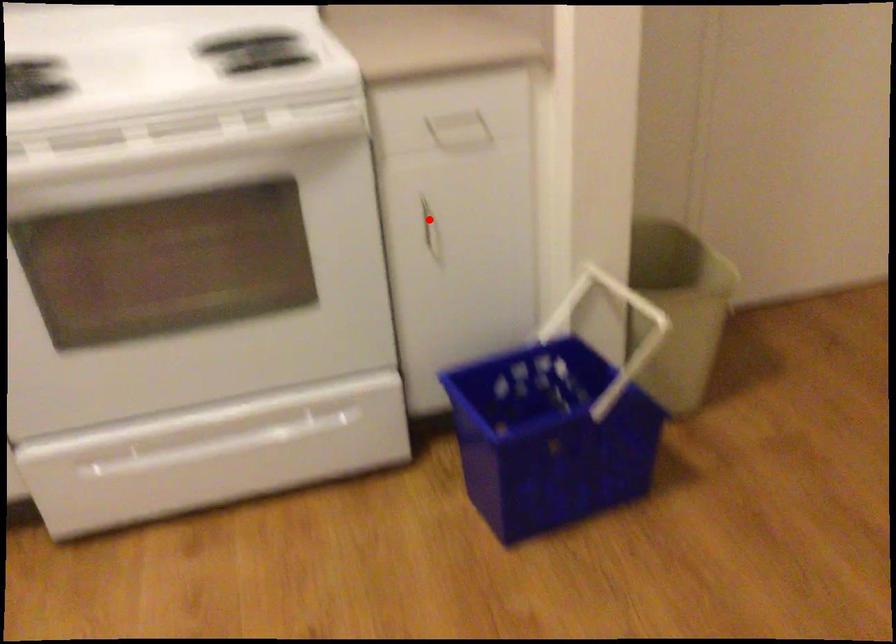
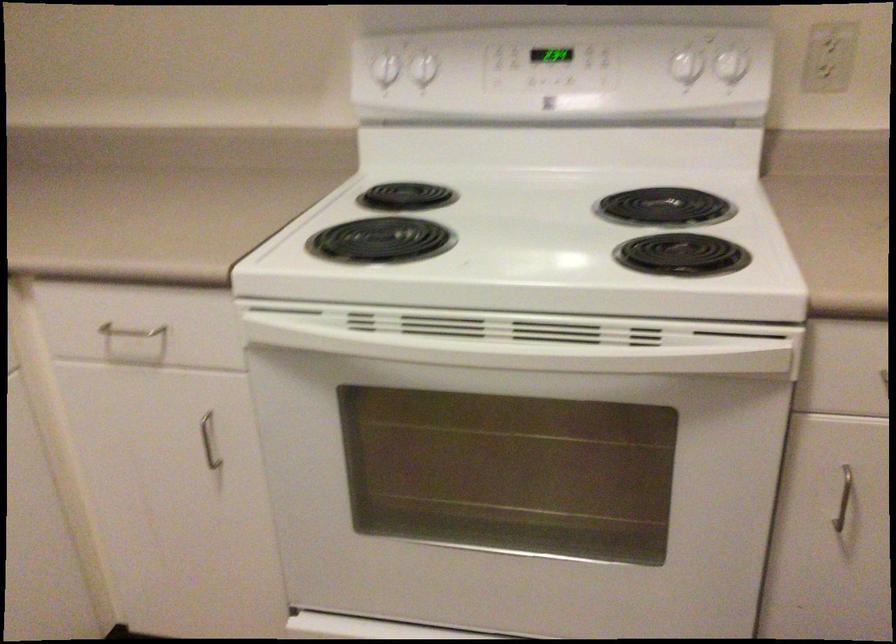
Question: I am providing you with two images of the same scene from different viewpoints. In image1, a red point is highlighted. Considering the same 3D point in image2, which of the following is correct?

Choices:
 (A) It is closer
 (B) It is farther

Answer: (A)